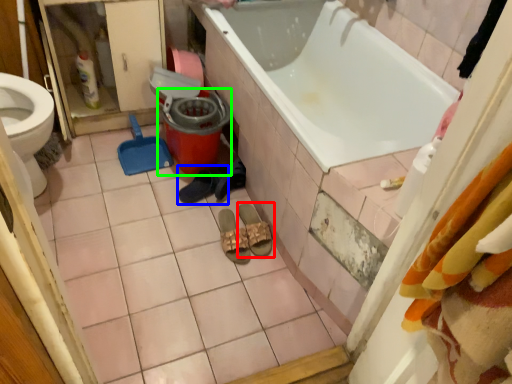
Question: Considering the real-world distances, which object is farthest from footwear (highlighted by a red box)? footwear (highlighted by a blue box) or potty (highlighted by a green box)?

Choices:
 (A) footwear
 (B) potty

Answer: (B)